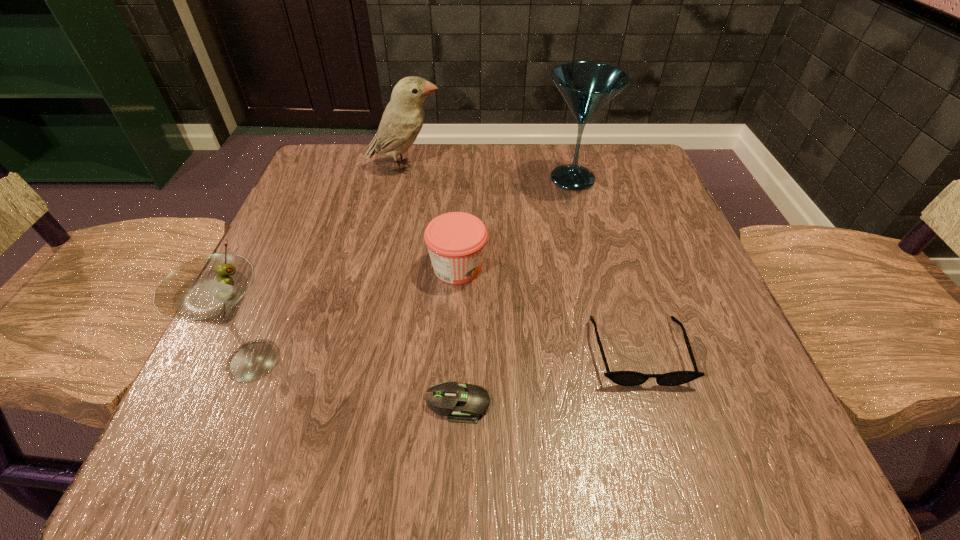
Image resolution: width=960 pixels, height=540 pixels. Find the location of `martini present at the right edge`. martini present at the right edge is located at coordinates (586, 86).

At what (x,y) coordinates should I click in order to perform the action: click on sunglasses present at the right edge. Please return your answer as a coordinate pair (x, y). Looking at the image, I should click on (624, 378).

You are a GUI agent. You are given a task and a screenshot of the screen. Output one action in this format:
    pyautogui.click(x=<x>, y=<y>)
    Task: Click on the object present at the far left corner
    This screenshot has height=540, width=960.
    Given the screenshot: What is the action you would take?
    pyautogui.click(x=402, y=120)

Where is `object present at the far right corner`? object present at the far right corner is located at coordinates (586, 86).

Find the location of a particular element. This screenshot has height=540, width=960. free space at the far edge is located at coordinates (404, 172).

The image size is (960, 540). I want to click on vacant space at the near edge of the desktop, so click(435, 420).

The image size is (960, 540). Identify the location of blank space at the left edge of the desktop. (300, 253).

This screenshot has width=960, height=540. Identify the location of vacant space at the right edge of the desktop. (714, 300).

Find the location of a particular element. The height and width of the screenshot is (540, 960). vacant area at the far left corner is located at coordinates (318, 179).

This screenshot has width=960, height=540. I want to click on vacant space at the near left corner of the desktop, so (x=266, y=415).